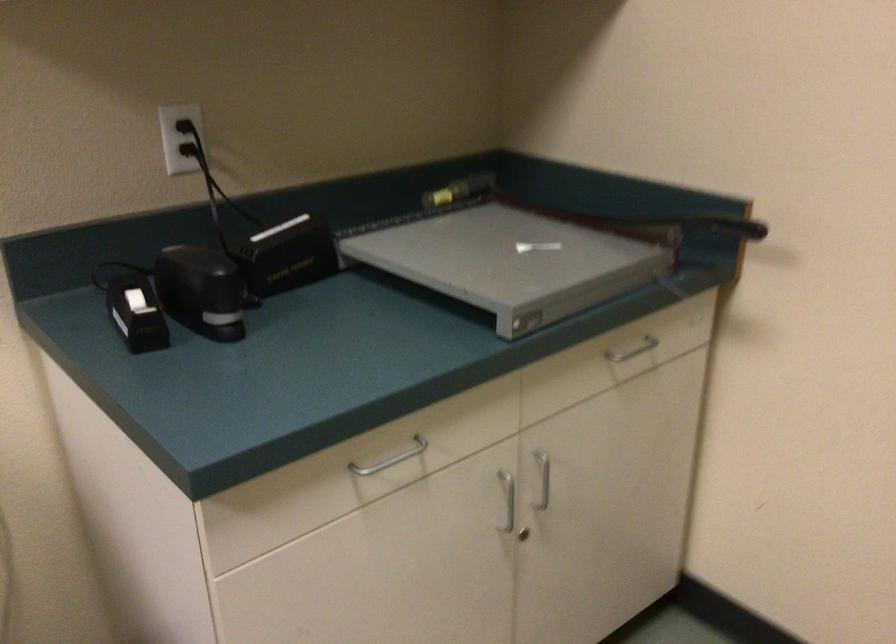
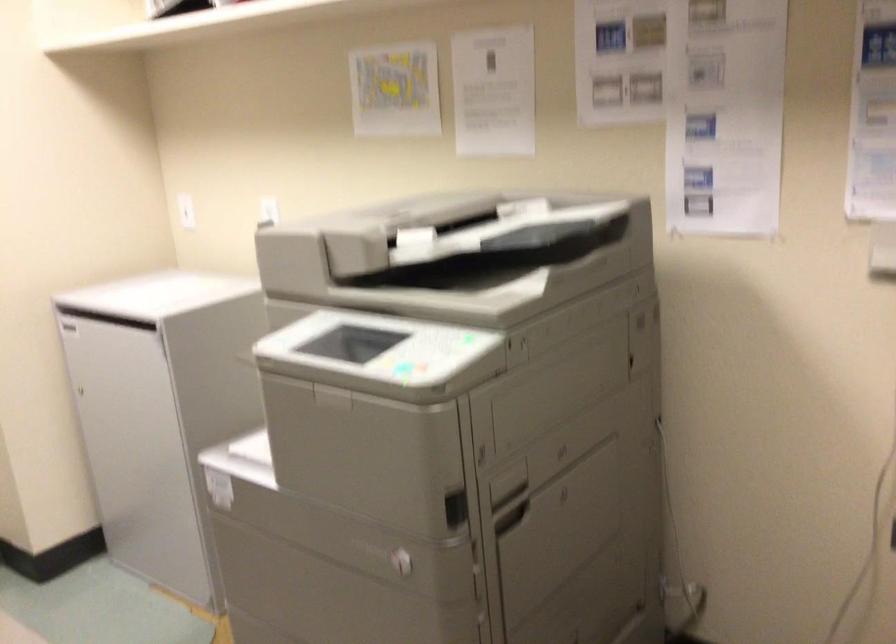
Question: The camera is either moving clockwise (left) or counter-clockwise (right) around the object. The first image is from the beginning of the video and the second image is from the end. Is the camera moving left or right when shooting the video?

Choices:
 (A) Left
 (B) Right

Answer: (B)